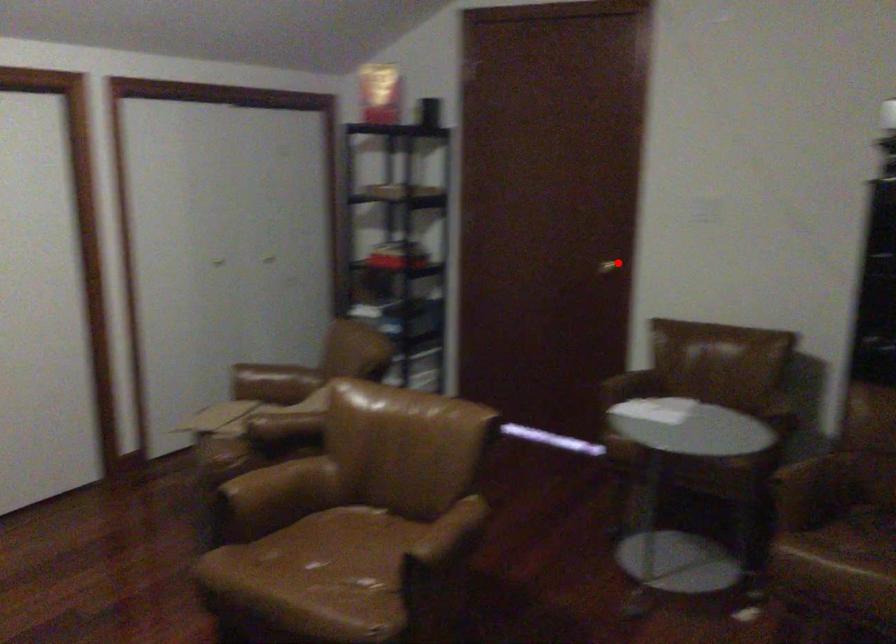
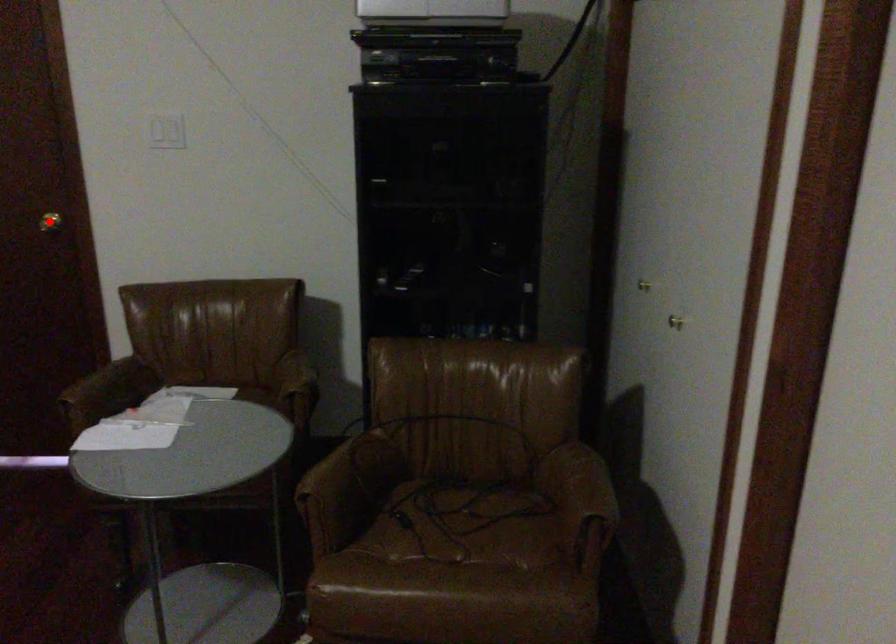
I am providing you with two images of the same scene from different viewpoints. A red point is marked on the first image and another point is marked on the second image. Does the point marked in image1 correspond to the same location as the one in image2?

Yes